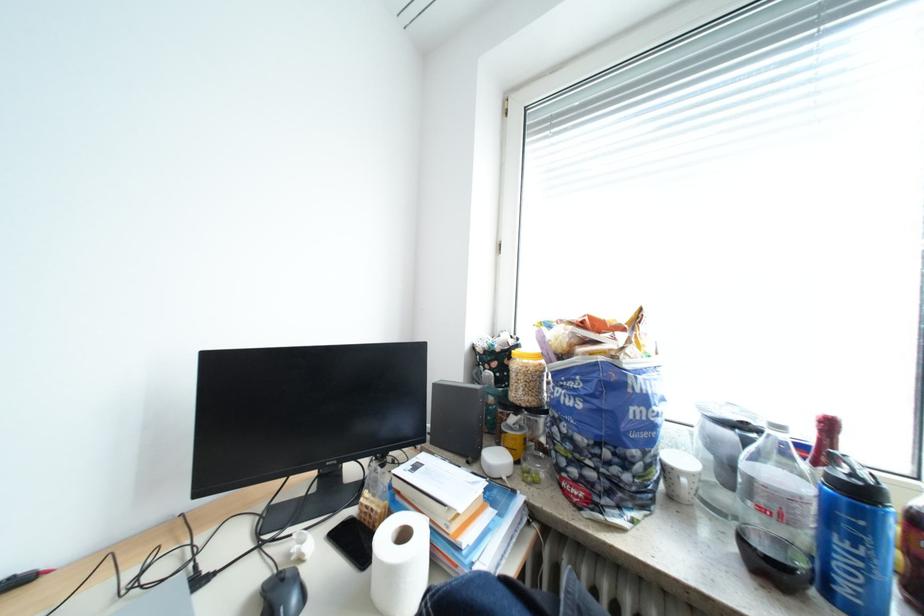
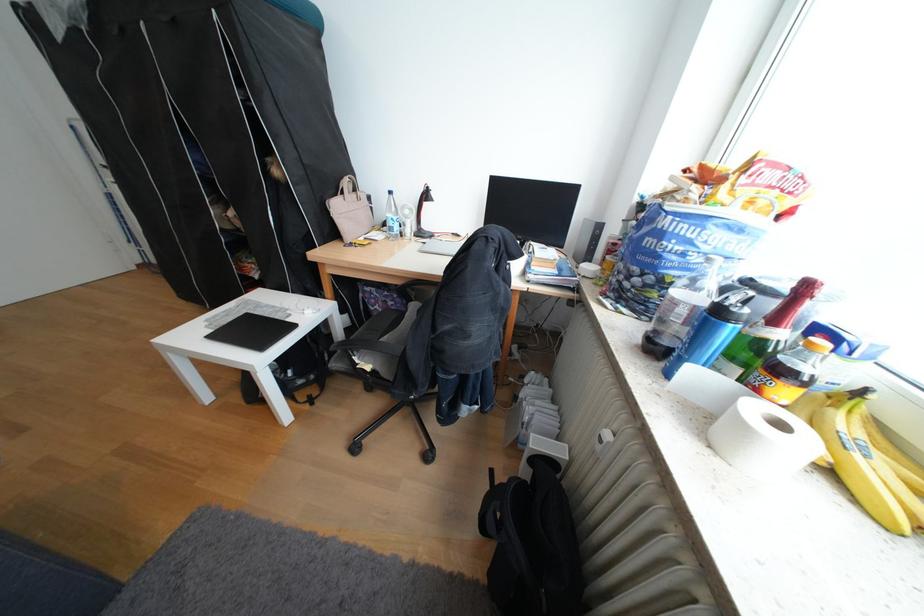
The point at (x=859, y=501) is marked in the first image. Where is the corresponding point in the second image?

(719, 314)